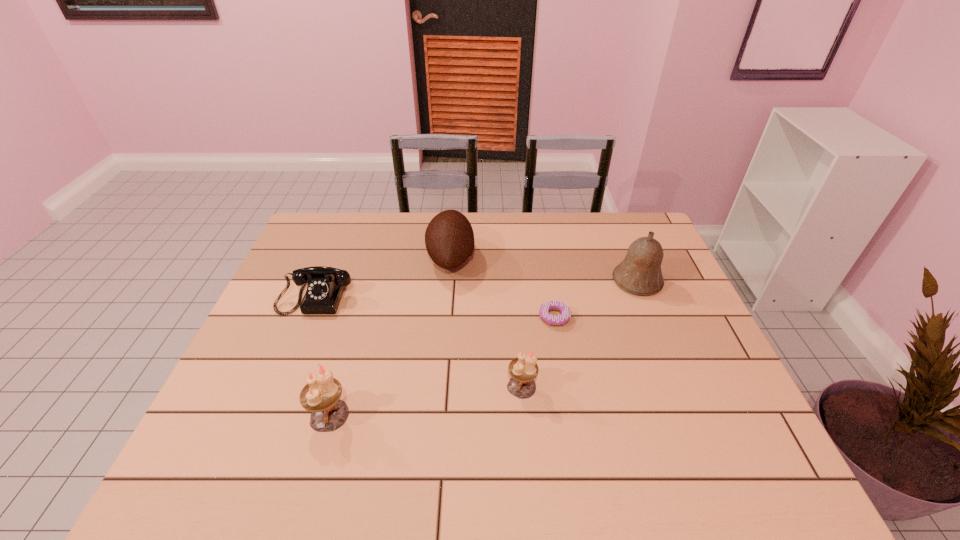
Where is `the taller candle holder`? Image resolution: width=960 pixels, height=540 pixels. the taller candle holder is located at coordinates 321,395.

Locate an element on the screen. The height and width of the screenshot is (540, 960). the right candle holder is located at coordinates (523, 369).

Identify the location of the fourth object from left to right. The width and height of the screenshot is (960, 540). (523, 369).

Identify the location of the third object from left to right. (449, 238).

I want to click on telephone, so click(x=325, y=286).

Where is `the rightmost object`? the rightmost object is located at coordinates (640, 273).

Locate an element on the screen. The height and width of the screenshot is (540, 960). the fifth object from left to right is located at coordinates (563, 308).

Identify the location of the shortest object. Image resolution: width=960 pixels, height=540 pixels. (563, 308).

Locate an element on the screen. free space located 0.080m on the back of the left candle holder is located at coordinates (342, 371).

The image size is (960, 540). In order to click on free location located on the left of the shorter candle holder in this screenshot , I will do `click(420, 386)`.